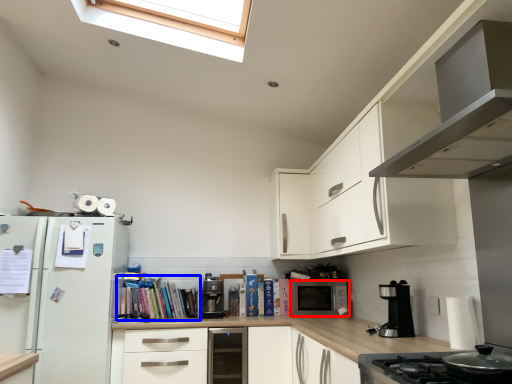
Question: Which point is further to the camera, microwave oven (highlighted by a red box) or book (highlighted by a blue box)?

Choices:
 (A) microwave oven
 (B) book

Answer: (A)